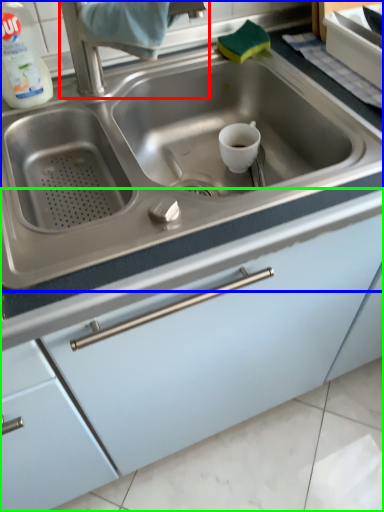
Question: Based on their relative distances, which object is nearer to faucet (highlighted by a red box)? Choose from sink (highlighted by a blue box) and cabinetry (highlighted by a green box).

Choices:
 (A) sink
 (B) cabinetry

Answer: (A)